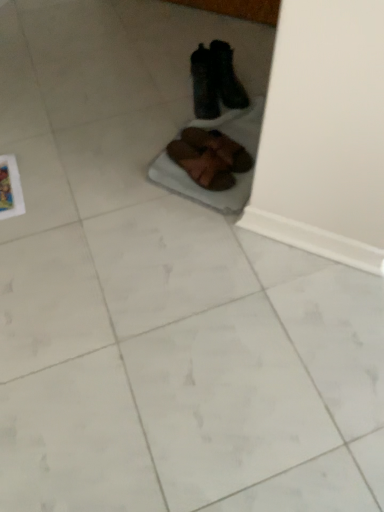
The image size is (384, 512). I want to click on black leather boots at upper center, positioned as the first footwear in top-to-bottom order, so click(x=215, y=81).

The image size is (384, 512). Describe the element at coordinates (202, 165) in the screenshot. I see `brown suede shoes at center, the first footwear from the bottom` at that location.

What are the coordinates of `black leather boots at upper center, positioned as the first footwear in top-to-bottom order` in the screenshot? It's located at (215, 81).

From the image's perspective, starting from the black leather boots at upper center, which ranks as the fourth footwear in bottom-to-top order, which footwear is the 2nd one below? Please provide its 2D coordinates.

[(218, 148)]

Is black leather boots at upper center, which ranks as the fourth footwear in bottom-to-top order, positioned far away from brown suede shoes at center, marked as the second footwear in a bottom-to-top arrangement?

No, black leather boots at upper center, which ranks as the fourth footwear in bottom-to-top order, is not far from brown suede shoes at center, marked as the second footwear in a bottom-to-top arrangement.

Considering the positions of points (226, 62) and (218, 149), is point (226, 62) closer to camera compared to point (218, 149)?

That is False.

Could you tell me if black fuzzy slippers at center, positioned as the 2th footwear in top-to-bottom order, is facing brown suede shoes at center, the first footwear from the bottom?

No, black fuzzy slippers at center, positioned as the 2th footwear in top-to-bottom order, is not turned towards brown suede shoes at center, the first footwear from the bottom.

You are a GUI agent. You are given a task and a screenshot of the screen. Output one action in this format:
    pyautogui.click(x=<x>, y=<y>)
    Task: Click on the 1st footwear counting from the right side of the brown suede shoes at center, the first footwear from the bottom
    The width and height of the screenshot is (384, 512).
    Given the screenshot: What is the action you would take?
    pyautogui.click(x=204, y=84)

Does black fuzzy slippers at center, positioned as the 2th footwear in top-to-bottom order, have a lesser height compared to brown suede shoes at center, placed as the 4th footwear when sorted from top to bottom?

No, black fuzzy slippers at center, positioned as the 2th footwear in top-to-bottom order, is not shorter than brown suede shoes at center, placed as the 4th footwear when sorted from top to bottom.

Considering the relative sizes of black fuzzy slippers at center, positioned as the 2th footwear in top-to-bottom order, and brown suede shoes at center, placed as the 4th footwear when sorted from top to bottom, in the image provided, is black fuzzy slippers at center, positioned as the 2th footwear in top-to-bottom order, bigger than brown suede shoes at center, placed as the 4th footwear when sorted from top to bottom,?

Yes, black fuzzy slippers at center, positioned as the 2th footwear in top-to-bottom order, is bigger than brown suede shoes at center, placed as the 4th footwear when sorted from top to bottom.

Could you tell me if brown suede shoes at center, which ranks as the third footwear in top-to-bottom order, is turned towards black leather boots at upper center, which ranks as the fourth footwear in bottom-to-top order?

No, brown suede shoes at center, which ranks as the third footwear in top-to-bottom order, is not turned towards black leather boots at upper center, which ranks as the fourth footwear in bottom-to-top order.

Is brown suede shoes at center, marked as the second footwear in a bottom-to-top arrangement, located outside black leather boots at upper center, positioned as the first footwear in top-to-bottom order?

Yes, brown suede shoes at center, marked as the second footwear in a bottom-to-top arrangement, is not within black leather boots at upper center, positioned as the first footwear in top-to-bottom order.

From a real-world perspective, who is located higher, brown suede shoes at center, which ranks as the third footwear in top-to-bottom order, or black leather boots at upper center, which ranks as the fourth footwear in bottom-to-top order?

black leather boots at upper center, which ranks as the fourth footwear in bottom-to-top order, from a real-world perspective.

Is brown suede shoes at center, placed as the 4th footwear when sorted from top to bottom, situated inside black leather boots at upper center, positioned as the first footwear in top-to-bottom order, or outside?

brown suede shoes at center, placed as the 4th footwear when sorted from top to bottom, exists outside the volume of black leather boots at upper center, positioned as the first footwear in top-to-bottom order.

Is brown suede shoes at center, the first footwear from the bottom, wider or thinner than black leather boots at upper center, which ranks as the fourth footwear in bottom-to-top order?

Considering their sizes, brown suede shoes at center, the first footwear from the bottom, looks broader than black leather boots at upper center, which ranks as the fourth footwear in bottom-to-top order.

Is brown suede shoes at center, the first footwear from the bottom, far from black leather boots at upper center, positioned as the first footwear in top-to-bottom order?

They are positioned close to each other.

Does brown suede shoes at center, placed as the 4th footwear when sorted from top to bottom, have a lesser height compared to black leather boots at upper center, which ranks as the fourth footwear in bottom-to-top order?

Yes, brown suede shoes at center, placed as the 4th footwear when sorted from top to bottom, is shorter than black leather boots at upper center, which ranks as the fourth footwear in bottom-to-top order.

Considering the sizes of objects black fuzzy slippers at center, which ranks as the third footwear in bottom-to-top order, and black leather boots at upper center, which ranks as the fourth footwear in bottom-to-top order, in the image provided, who is taller, black fuzzy slippers at center, which ranks as the third footwear in bottom-to-top order, or black leather boots at upper center, which ranks as the fourth footwear in bottom-to-top order,?

black leather boots at upper center, which ranks as the fourth footwear in bottom-to-top order.

From the image's perspective, is black fuzzy slippers at center, which ranks as the third footwear in bottom-to-top order, beneath black leather boots at upper center, positioned as the first footwear in top-to-bottom order?

Yes.

Based on the photo, in the image, is black fuzzy slippers at center, which ranks as the third footwear in bottom-to-top order, on the left side or the right side of black leather boots at upper center, which ranks as the fourth footwear in bottom-to-top order?

From the image, it's evident that black fuzzy slippers at center, which ranks as the third footwear in bottom-to-top order, is to the left of black leather boots at upper center, which ranks as the fourth footwear in bottom-to-top order.

Can we say black fuzzy slippers at center, positioned as the 2th footwear in top-to-bottom order, lies outside black leather boots at upper center, positioned as the first footwear in top-to-bottom order?

Yes, black fuzzy slippers at center, positioned as the 2th footwear in top-to-bottom order, is located beyond the bounds of black leather boots at upper center, positioned as the first footwear in top-to-bottom order.

Looking at this image, from the image's perspective, between brown suede shoes at center, which ranks as the third footwear in top-to-bottom order, and brown suede shoes at center, placed as the 4th footwear when sorted from top to bottom, which one is located above?

brown suede shoes at center, which ranks as the third footwear in top-to-bottom order, appears higher in the image.

Between brown suede shoes at center, which ranks as the third footwear in top-to-bottom order, and brown suede shoes at center, placed as the 4th footwear when sorted from top to bottom, which one has larger width?

brown suede shoes at center, placed as the 4th footwear when sorted from top to bottom, is wider.

From a real-world perspective, which object rests below the other?

In real-world perspective, brown suede shoes at center, the first footwear from the bottom, is lower.

What's the angular difference between brown suede shoes at center, which ranks as the third footwear in top-to-bottom order, and brown suede shoes at center, the first footwear from the bottom,'s facing directions?

10.2 degrees separate the facing orientations of brown suede shoes at center, which ranks as the third footwear in top-to-bottom order, and brown suede shoes at center, the first footwear from the bottom.

Can you tell me how much brown suede shoes at center, which ranks as the third footwear in top-to-bottom order, and black fuzzy slippers at center, which ranks as the third footwear in bottom-to-top order, differ in facing direction?

The angle between the facing direction of brown suede shoes at center, which ranks as the third footwear in top-to-bottom order, and the facing direction of black fuzzy slippers at center, which ranks as the third footwear in bottom-to-top order, is 36.6 degrees.

Considering the relative sizes of brown suede shoes at center, which ranks as the third footwear in top-to-bottom order, and black fuzzy slippers at center, which ranks as the third footwear in bottom-to-top order, in the image provided, is brown suede shoes at center, which ranks as the third footwear in top-to-bottom order, smaller than black fuzzy slippers at center, which ranks as the third footwear in bottom-to-top order,?

Yes, brown suede shoes at center, which ranks as the third footwear in top-to-bottom order, is smaller than black fuzzy slippers at center, which ranks as the third footwear in bottom-to-top order.

In the scene shown: How much distance is there between brown suede shoes at center, which ranks as the third footwear in top-to-bottom order, and black fuzzy slippers at center, positioned as the 2th footwear in top-to-bottom order?

brown suede shoes at center, which ranks as the third footwear in top-to-bottom order, and black fuzzy slippers at center, positioned as the 2th footwear in top-to-bottom order, are 17.99 centimeters apart from each other.

Would you say brown suede shoes at center, which ranks as the third footwear in top-to-bottom order, contains black fuzzy slippers at center, which ranks as the third footwear in bottom-to-top order?

No, black fuzzy slippers at center, which ranks as the third footwear in bottom-to-top order, is not inside brown suede shoes at center, which ranks as the third footwear in top-to-bottom order.

From the brown suede shoes at center, marked as the second footwear in a bottom-to-top arrangement, count 2nd footwears backward and point to it. Please provide its 2D coordinates.

[(215, 81)]

Locate an element on the screen. The image size is (384, 512). the 2nd footwear above the brown suede shoes at center, placed as the 4th footwear when sorted from top to bottom (from the image's perspective) is located at coordinates (204, 84).

Looking at the image, which one is located further to brown suede shoes at center, the first footwear from the bottom, brown suede shoes at center, marked as the second footwear in a bottom-to-top arrangement, or black fuzzy slippers at center, which ranks as the third footwear in bottom-to-top order?

Among the two, black fuzzy slippers at center, which ranks as the third footwear in bottom-to-top order, is located further to brown suede shoes at center, the first footwear from the bottom.

Based on their spatial positions, is black fuzzy slippers at center, which ranks as the third footwear in bottom-to-top order, or brown suede shoes at center, placed as the 4th footwear when sorted from top to bottom, closer to brown suede shoes at center, which ranks as the third footwear in top-to-bottom order?

Among the two, brown suede shoes at center, placed as the 4th footwear when sorted from top to bottom, is located nearer to brown suede shoes at center, which ranks as the third footwear in top-to-bottom order.

Which object lies further to the anchor point black leather boots at upper center, which ranks as the fourth footwear in bottom-to-top order, black fuzzy slippers at center, positioned as the 2th footwear in top-to-bottom order, or brown suede shoes at center, which ranks as the third footwear in top-to-bottom order?

brown suede shoes at center, which ranks as the third footwear in top-to-bottom order, lies further to black leather boots at upper center, which ranks as the fourth footwear in bottom-to-top order, than the other object.

From the picture: Looking at the image, which one is located closer to brown suede shoes at center, the first footwear from the bottom, black fuzzy slippers at center, which ranks as the third footwear in bottom-to-top order, or black leather boots at upper center, positioned as the first footwear in top-to-bottom order?

black fuzzy slippers at center, which ranks as the third footwear in bottom-to-top order, lies closer to brown suede shoes at center, the first footwear from the bottom, than the other object.

Based on their spatial positions, is black fuzzy slippers at center, positioned as the 2th footwear in top-to-bottom order, or brown suede shoes at center, the first footwear from the bottom, closer to black leather boots at upper center, which ranks as the fourth footwear in bottom-to-top order?

The object closer to black leather boots at upper center, which ranks as the fourth footwear in bottom-to-top order, is black fuzzy slippers at center, positioned as the 2th footwear in top-to-bottom order.

Considering their positions, is black fuzzy slippers at center, which ranks as the third footwear in bottom-to-top order, positioned further to brown suede shoes at center, placed as the 4th footwear when sorted from top to bottom, than brown suede shoes at center, marked as the second footwear in a bottom-to-top arrangement?

black fuzzy slippers at center, which ranks as the third footwear in bottom-to-top order.

Looking at the image, which one is located closer to black fuzzy slippers at center, positioned as the 2th footwear in top-to-bottom order, black leather boots at upper center, which ranks as the fourth footwear in bottom-to-top order, or brown suede shoes at center, placed as the 4th footwear when sorted from top to bottom?

Among the two, black leather boots at upper center, which ranks as the fourth footwear in bottom-to-top order, is located nearer to black fuzzy slippers at center, positioned as the 2th footwear in top-to-bottom order.

Looking at this image, looking at the image, which one is located closer to black leather boots at upper center, positioned as the first footwear in top-to-bottom order, brown suede shoes at center, placed as the 4th footwear when sorted from top to bottom, or black fuzzy slippers at center, positioned as the 2th footwear in top-to-bottom order?

Based on the image, black fuzzy slippers at center, positioned as the 2th footwear in top-to-bottom order, appears to be nearer to black leather boots at upper center, positioned as the first footwear in top-to-bottom order.

Locate an element on the screen. This screenshot has width=384, height=512. footwear between black fuzzy slippers at center, positioned as the 2th footwear in top-to-bottom order, and brown suede shoes at center, the first footwear from the bottom, in the up-down direction is located at coordinates pyautogui.click(x=218, y=148).

Identify the location of footwear between black leather boots at upper center, which ranks as the fourth footwear in bottom-to-top order, and brown suede shoes at center, which ranks as the third footwear in top-to-bottom order, from top to bottom. (204, 84).